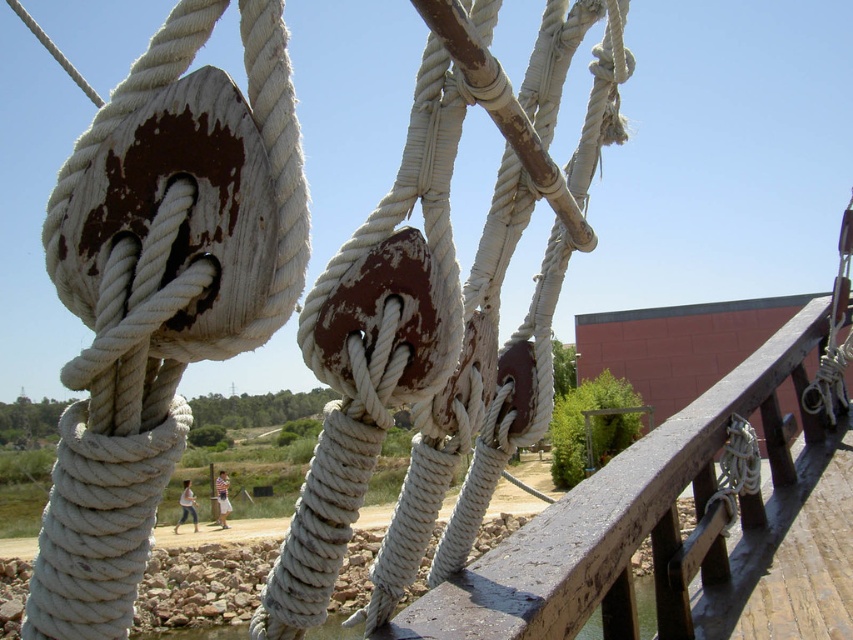
Who is higher up, rustic wood rail at center or clear water at lower left?

rustic wood rail at center

You are a GUI agent. You are given a task and a screenshot of the screen. Output one action in this format:
    pyautogui.click(x=<x>, y=<y>)
    Task: Click on the rustic wood rail at center
    
    Given the screenshot: What is the action you would take?
    pyautogui.click(x=624, y=520)